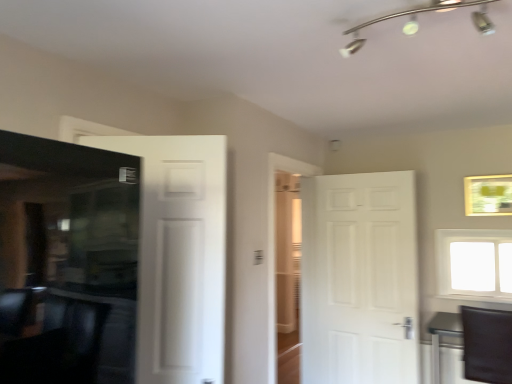
Question: Visually, is black leather swivel chair at lower right positioned to the left or to the right of green matte picture frame at upper right?

Choices:
 (A) right
 (B) left

Answer: (B)

Question: In terms of size, does black leather swivel chair at lower right appear bigger or smaller than green matte picture frame at upper right?

Choices:
 (A) small
 (B) big

Answer: (B)

Question: Which is nearer to the green matte picture frame at upper right?

Choices:
 (A) silver metallic track lighting at upper center
 (B) black leather swivel chair at lower right
 (C) white matte door at right, the 2th door from the front
 (D) white frosted glass window at upper right
 (E) white matte door at left, acting as the 1th door starting from the left

Answer: (D)

Question: Based on their relative distances, which object is nearer to the silver metallic track lighting at upper center?

Choices:
 (A) white matte door at right, which ranks as the first door in right-to-left order
 (B) black leather swivel chair at lower right
 (C) white frosted glass window at upper right
 (D) green matte picture frame at upper right
 (E) white matte door at left, marked as the second door in a right-to-left arrangement

Answer: (E)